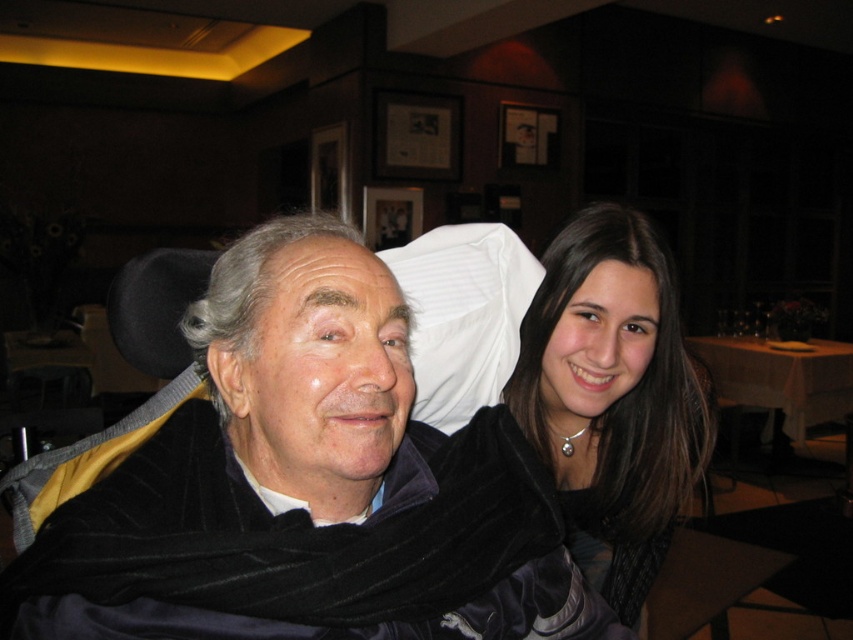
Does velvet black jacket at upper right have a greater width compared to white tablecloth at right?

No, velvet black jacket at upper right is not wider than white tablecloth at right.

Can you confirm if velvet black jacket at upper right is taller than white tablecloth at right?

No, velvet black jacket at upper right is not taller than white tablecloth at right.

Is point (647, 588) closer to viewer compared to point (851, 394)?

Yes, point (647, 588) is closer to viewer.

I want to click on velvet black jacket at upper right, so click(x=612, y=397).

Who is more distant from viewer, (595, 612) or (666, 328)?

The point (666, 328) is behind.

Is velvet black jacket at center taller than velvet black jacket at upper right?

No.

Who is more distant from viewer, (x=206, y=552) or (x=560, y=392)?

The point (x=560, y=392) is behind.

At what (x,y) coordinates should I click in order to perform the action: click on velvet black jacket at center. Please return your answer as a coordinate pair (x, y). The image size is (853, 640). Looking at the image, I should click on (277, 460).

Between velvet black jacket at center and white tablecloth at right, which one is positioned lower?

white tablecloth at right

Is velvet black jacket at center below white tablecloth at right?

Actually, velvet black jacket at center is above white tablecloth at right.

The height and width of the screenshot is (640, 853). What are the coordinates of `velvet black jacket at center` in the screenshot? It's located at (277, 460).